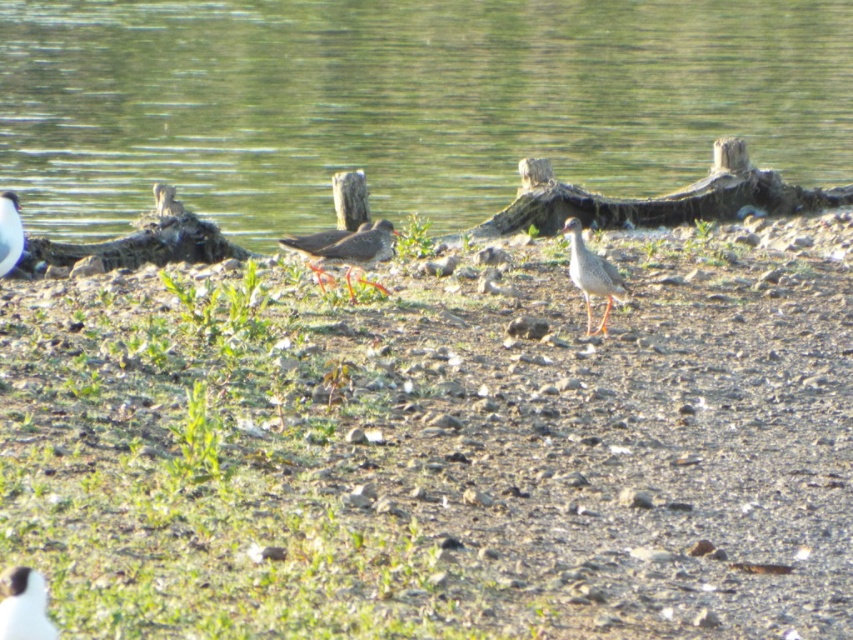
Image resolution: width=853 pixels, height=640 pixels. Describe the element at coordinates (22, 605) in the screenshot. I see `white matte bird at lower left` at that location.

Is white matte bird at lower left in front of speckled gray bird at center?

That is True.

Who is more distant from viewer, (9,588) or (606,276)?

Point (606,276)

Locate an element on the screen. This screenshot has height=640, width=853. white matte bird at lower left is located at coordinates (22, 605).

Who is shorter, green water at center or speckled feathered bird at center?

With less height is speckled feathered bird at center.

Which of these two, green water at center or speckled feathered bird at center, stands taller?

With more height is green water at center.

Who is more distant from viewer, (71, 68) or (372, 232)?

Positioned behind is point (71, 68).

This screenshot has height=640, width=853. I want to click on green water at center, so click(x=402, y=104).

Does point (593, 252) come closer to viewer compared to point (0, 202)?

No, (593, 252) is behind (0, 202).

Is point (614, 291) farther from camera compared to point (18, 236)?

Yes, point (614, 291) is farther from viewer.

Does point (608, 275) lie in front of point (13, 220)?

That is False.

Locate an element on the screen. The height and width of the screenshot is (640, 853). speckled gray bird at center is located at coordinates (590, 273).